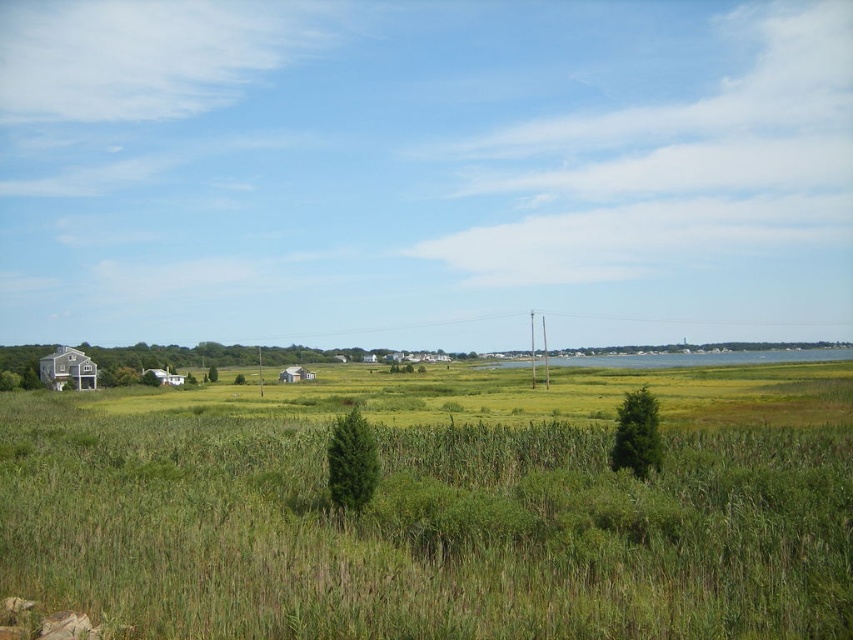
You are a hiker who wants to visit both the wooden cabin at left and the white corrugated metal hut at center. Starting from the right side of the image, which structure should you head towards first to reach them in the correct order?

You should head towards the white corrugated metal hut at center first because the wooden cabin at left is located to the left of it. Since you are starting from the right side, moving towards the center first allows you to then proceed leftwards to the cabin.

You are standing at the origin point of the coordinate system in the image. You want to reach the wooden cabin at left. What direction should you move in to get there?

Since the wooden cabin at left is located at coordinate point 0.578 on the x axis and 0.080 on the y axis, you should move towards the positive x direction and slightly positive y direction to reach it.

You are standing in the middle of the tall grasses and reeds in the foreground of the rural landscape. You see the wooden cabin at left and the white matte house at lower left. Which of these two structures is located more to the left?

The wooden cabin at left is positioned on the left side of the white matte house at lower left, so the wooden cabin at left is more to the left.